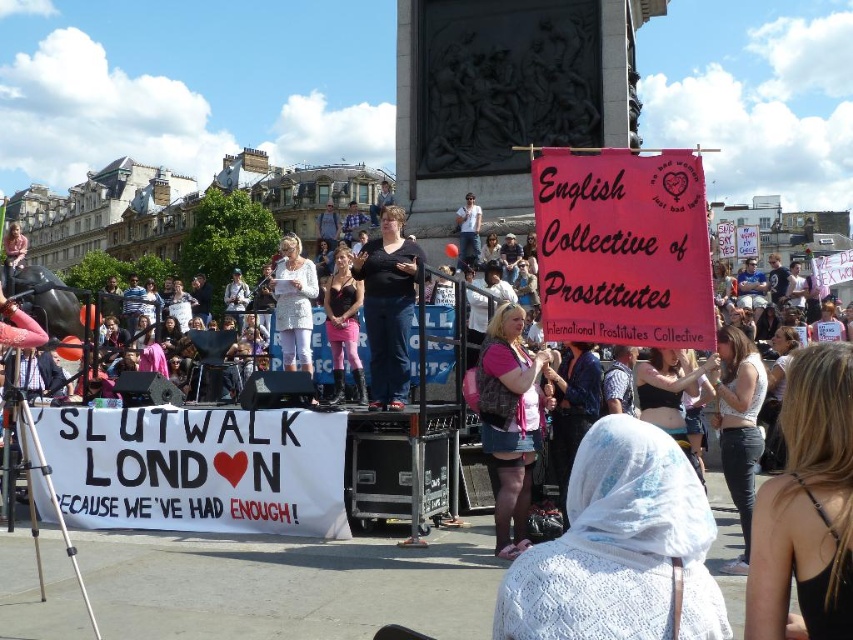
Question: Which of these objects is positioned farthest from the pink fabric top at center?

Choices:
 (A) pink fabric pants at center
 (B) black fabric at center

Answer: (A)

Question: Which object is the closest to the white lace top at center?

Choices:
 (A) pink fabric pants at center
 (B) black fabric at center

Answer: (B)

Question: Is the position of blonde hair at lower right less distant than that of black fabric at center?

Choices:
 (A) no
 (B) yes

Answer: (B)

Question: Does blonde hair at lower right appear on the right side of white lace top at center?

Choices:
 (A) yes
 (B) no

Answer: (B)

Question: In this image, where is black fabric at center located relative to pink fabric pants at center?

Choices:
 (A) below
 (B) above

Answer: (A)

Question: Which point is farther from the camera taking this photo?

Choices:
 (A) (515, 316)
 (B) (819, 522)
 (C) (347, 328)

Answer: (C)